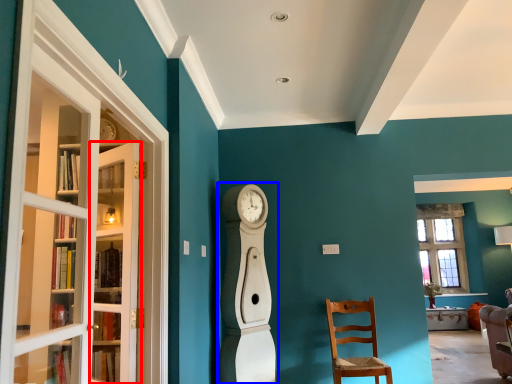
Question: Which of the following is the closest to the observer, door (highlighted by a red box) or open (highlighted by a blue box)?

Choices:
 (A) door
 (B) open

Answer: (A)